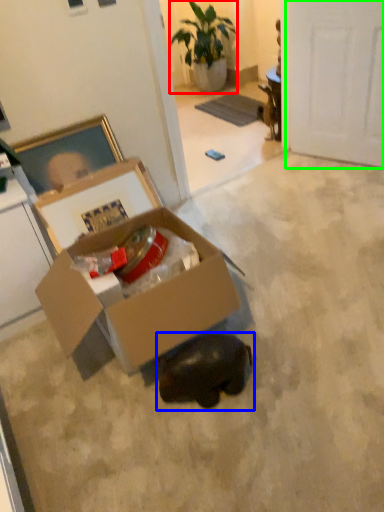
Question: Which is farther away from houseplant (highlighted by a red box)? animal (highlighted by a blue box) or door (highlighted by a green box)?

Choices:
 (A) animal
 (B) door

Answer: (A)